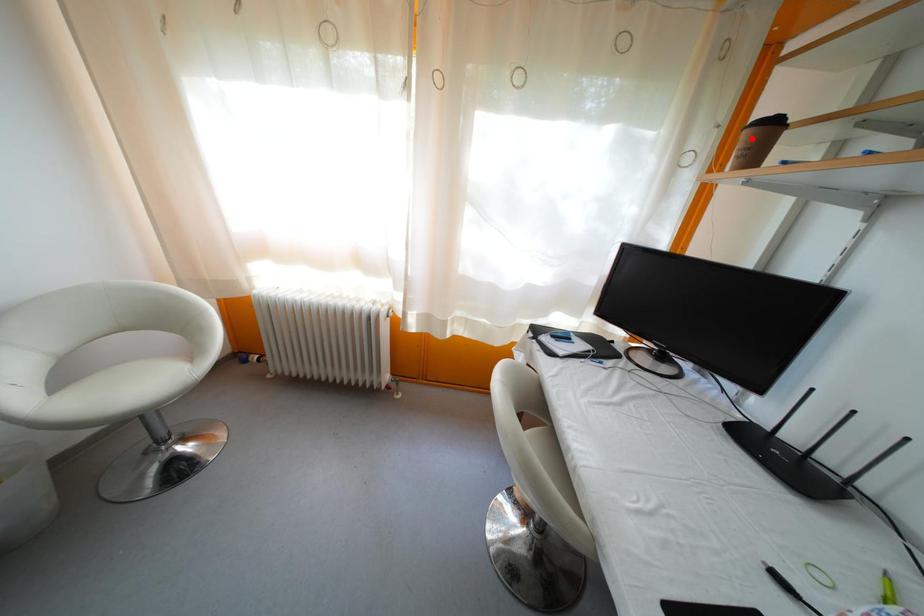
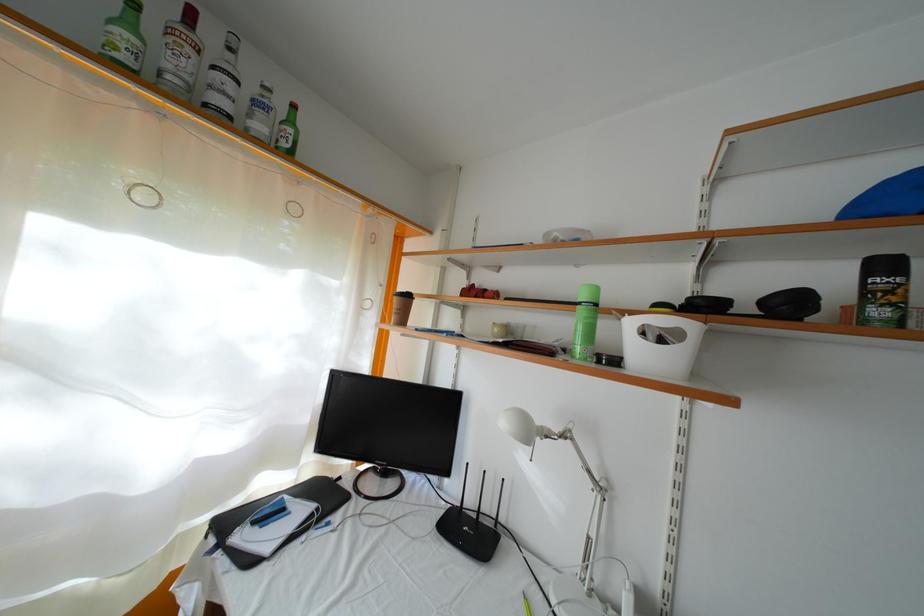
Find the pixel in the second image that matches the highlighted location in the first image.

(400, 305)